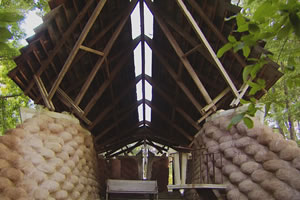
I want to click on light, so click(150, 23), click(147, 55), click(148, 86), click(147, 117), click(139, 109), click(141, 91), click(137, 62), click(136, 27).